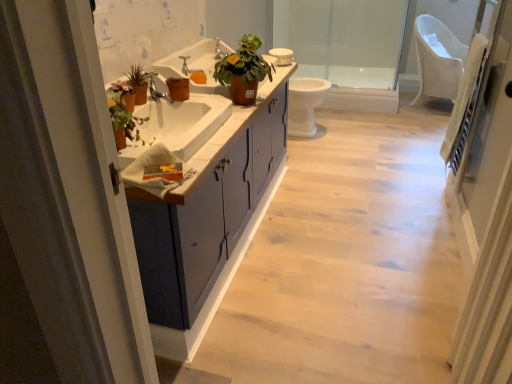
Question: From a real-world perspective, is white glossy toilet at center physically located above or below matte terracotta pot at center?

Choices:
 (A) below
 (B) above

Answer: (A)

Question: Does point (297, 104) appear closer or farther from the camera than point (229, 74)?

Choices:
 (A) closer
 (B) farther

Answer: (B)

Question: Which object is the closest to the matte terracotta pot at center?

Choices:
 (A) white textured screen door at right
 (B) white glossy toilet at center
 (C) polished chrome faucet at center, which is counted as the 2th faucet, starting from the top
 (D) matte gray cabinet at center
 (E) silver metallic faucet at upper center, the first faucet viewed from the right

Answer: (E)

Question: Which object is positioned farthest from the matte terracotta pot at center?

Choices:
 (A) matte gray cabinet at center
 (B) silver metallic faucet at upper center, the 2th faucet viewed from the front
 (C) polished chrome faucet at center, placed as the 2th faucet when sorted from right to left
 (D) matte silver faucet at upper center
 (E) matte white cabinet at center

Answer: (A)